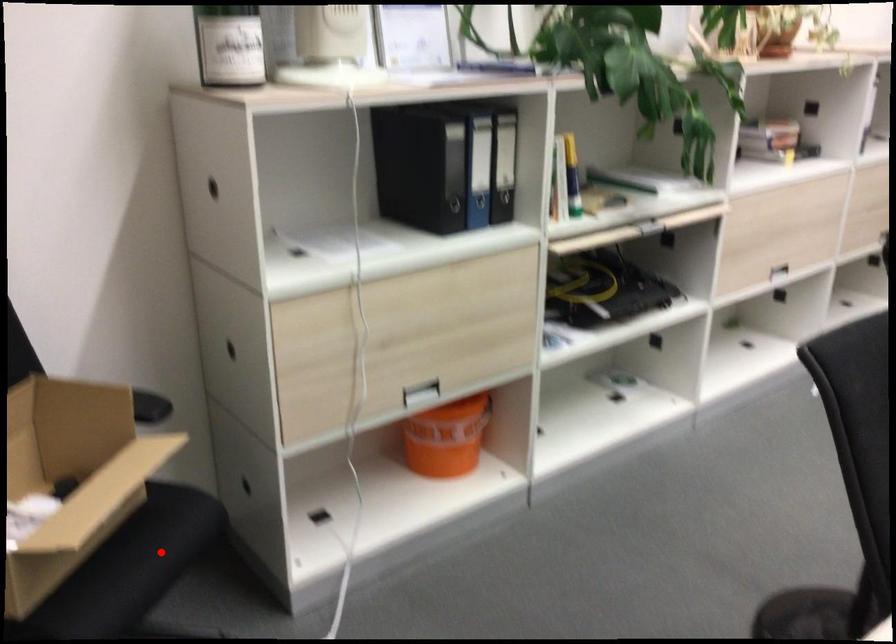
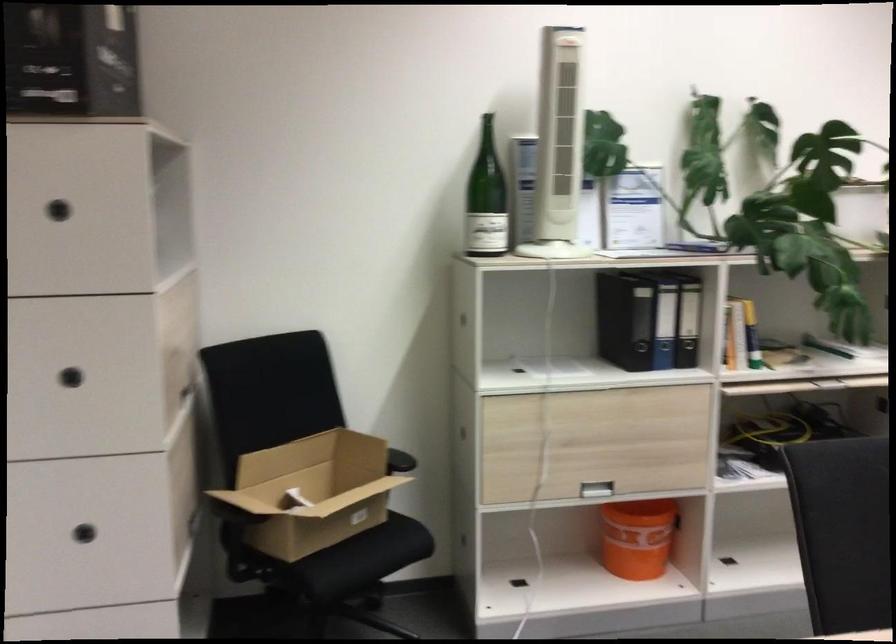
Question: I am providing you with two images of the same scene from different viewpoints. In image1, a red point is highlighted. Considering the same 3D point in image2, which of the following is correct?

Choices:
 (A) It is closer
 (B) It is farther

Answer: (B)